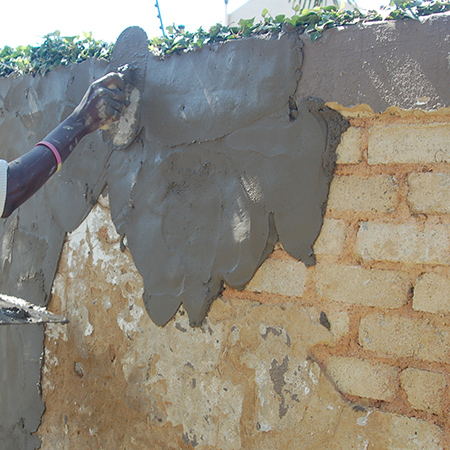
This screenshot has width=450, height=450. Find the location of `brick wall`. brick wall is located at coordinates (380, 383).